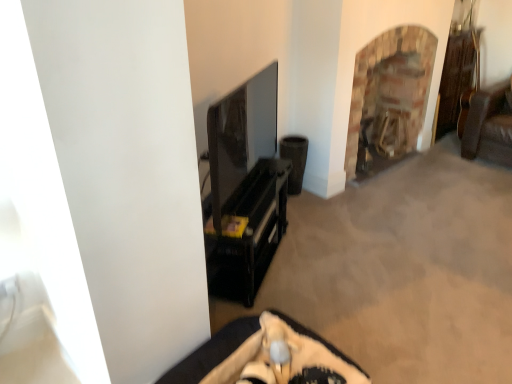
Question: Is brick fireplace at upper right closer to camera compared to brown woven speaker at center-right?

Choices:
 (A) no
 (B) yes

Answer: (B)

Question: Is brick fireplace at upper right at the left side of brown woven speaker at center-right?

Choices:
 (A) no
 (B) yes

Answer: (A)

Question: From the image's perspective, is brick fireplace at upper right beneath brown woven speaker at center-right?

Choices:
 (A) yes
 (B) no

Answer: (B)

Question: Can you confirm if brick fireplace at upper right is shorter than brown woven speaker at center-right?

Choices:
 (A) no
 (B) yes

Answer: (A)

Question: From a real-world perspective, is brick fireplace at upper right physically above brown woven speaker at center-right?

Choices:
 (A) no
 (B) yes

Answer: (B)

Question: Could brown woven speaker at center-right be considered to be inside brick fireplace at upper right?

Choices:
 (A) yes
 (B) no

Answer: (B)

Question: Is brown woven speaker at center-right at the right side of brick fireplace at upper right?

Choices:
 (A) yes
 (B) no

Answer: (B)

Question: From a real-world perspective, is brown woven speaker at center-right positioned under brick fireplace at upper right based on gravity?

Choices:
 (A) yes
 (B) no

Answer: (A)

Question: From the image's perspective, is brown woven speaker at center-right below brick fireplace at upper right?

Choices:
 (A) yes
 (B) no

Answer: (A)

Question: From the image's perspective, would you say brown woven speaker at center-right is positioned over brick fireplace at upper right?

Choices:
 (A) yes
 (B) no

Answer: (B)

Question: Considering the relative sizes of brown woven speaker at center-right and brick fireplace at upper right in the image provided, is brown woven speaker at center-right shorter than brick fireplace at upper right?

Choices:
 (A) no
 (B) yes

Answer: (B)

Question: Would you say brown woven speaker at center-right is a long distance from brick fireplace at upper right?

Choices:
 (A) no
 (B) yes

Answer: (A)

Question: Is brown woven speaker at center-right positioned with its back to black glossy tv stand at center, placed as the 2th furniture when sorted from front to back?

Choices:
 (A) yes
 (B) no

Answer: (B)